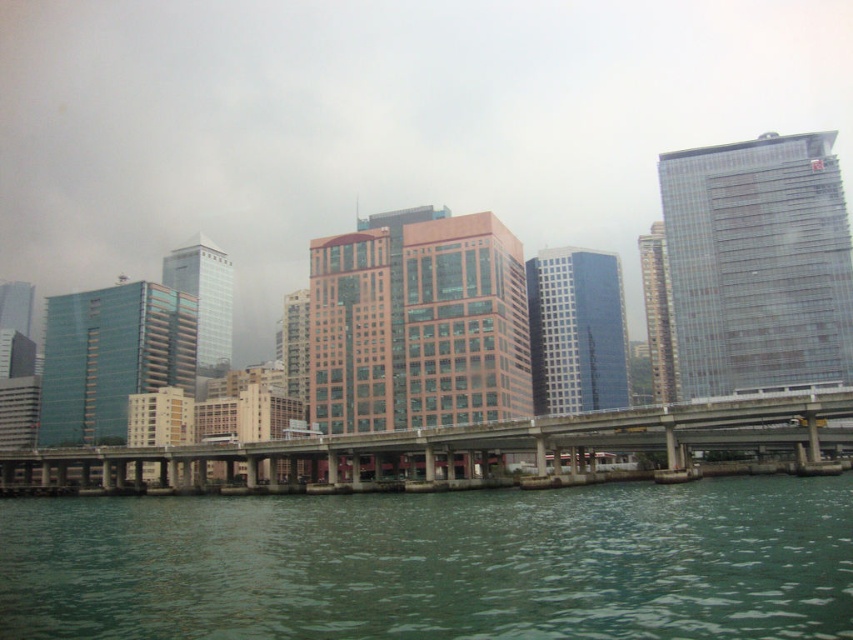
Is concrete bridge at center positioned before transparent glass building at right?

Yes, concrete bridge at center is closer to the viewer.

The width and height of the screenshot is (853, 640). What do you see at coordinates (444, 451) in the screenshot?
I see `concrete bridge at center` at bounding box center [444, 451].

Does point (467, 438) come behind point (838, 248)?

That is False.

I want to click on concrete bridge at center, so click(444, 451).

Is transparent glass building at left wider than metallic glass tower at center?

Indeed, transparent glass building at left has a greater width compared to metallic glass tower at center.

In the scene shown: Who is higher up, transparent glass building at left or metallic glass tower at center?

metallic glass tower at center is above.

Is point (109, 339) closer to camera compared to point (669, 355)?

No, it is not.

This screenshot has width=853, height=640. Identify the location of transparent glass building at left. (111, 356).

Can you confirm if concrete bridge at center is bigger than transparent glass building at left?

Indeed, concrete bridge at center has a larger size compared to transparent glass building at left.

Is concrete bridge at center wider than transparent glass building at left?

Indeed, concrete bridge at center has a greater width compared to transparent glass building at left.

Who is more distant from viewer, (305, 476) or (192, 342)?

The point (192, 342) is behind.

You are a GUI agent. You are given a task and a screenshot of the screen. Output one action in this format:
    pyautogui.click(x=<x>, y=<y>)
    Task: Click on the concrete bridge at center
    This screenshot has width=853, height=640.
    Given the screenshot: What is the action you would take?
    pyautogui.click(x=444, y=451)